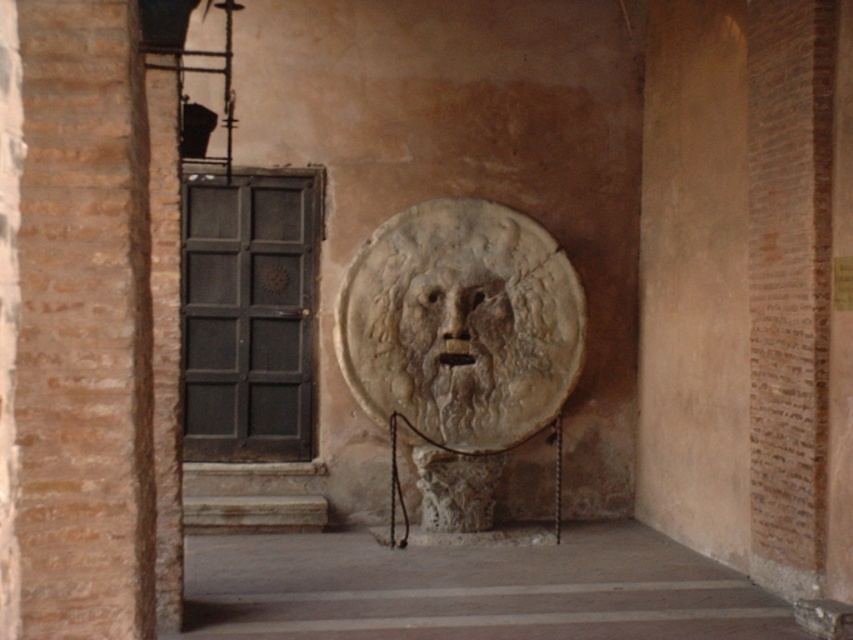
Between white marble face at center and carved stone face at center, which one has more height?

Standing taller between the two is white marble face at center.

The height and width of the screenshot is (640, 853). In order to click on white marble face at center in this screenshot , I will do `click(461, 346)`.

Identify the location of white marble face at center. (461, 346).